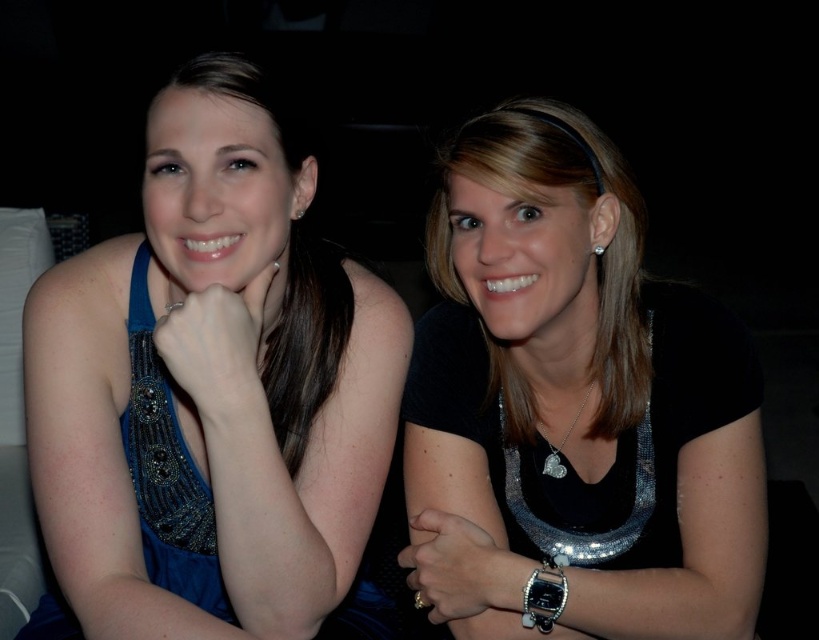
Please look at the image and locate the black sequined dress at center. What are its coordinates?

The black sequined dress at center is located at coordinates point [573,403].

You are a fashion designer observing the two dresses in the image. The blue beaded dress at left and the black sequined dress at center. Which dress has a bigger size?

The blue beaded dress at left has a larger size compared to the black sequined dress at center.